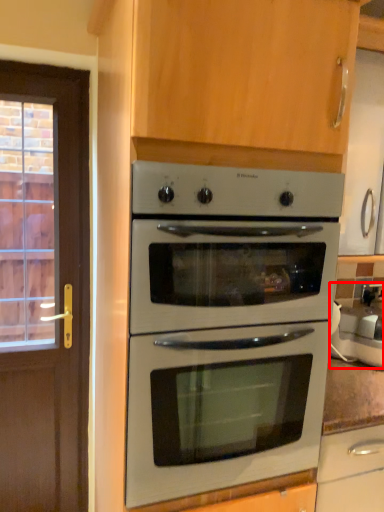
Question: In this image, where is appliance (annotated by the red box) located relative to oven?

Choices:
 (A) left
 (B) right

Answer: (B)